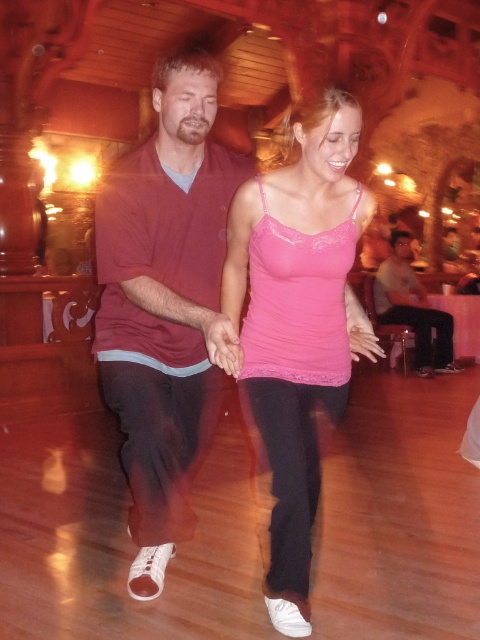
Between point (197, 276) and point (313, 156), which one is positioned in front?

Point (313, 156) is more forward.

From the picture: Does matte maroon shirt at center lie in front of pink lace tank top at center?

Yes, matte maroon shirt at center is in front of pink lace tank top at center.

Locate an element on the screen. This screenshot has height=640, width=480. matte maroon shirt at center is located at coordinates (x=165, y=301).

Can you confirm if pink lace tank top at center is shorter than gray cotton shirt at center?

Correct, pink lace tank top at center is not as tall as gray cotton shirt at center.

Looking at this image, does pink lace tank top at center appear over gray cotton shirt at center?

No, pink lace tank top at center is not above gray cotton shirt at center.

Where is `pink lace tank top at center`? pink lace tank top at center is located at coordinates (299, 323).

Does matte maroon shirt at center lie in front of gray cotton shirt at center?

Yes, matte maroon shirt at center is closer to the viewer.

Is matte maroon shirt at center wider than gray cotton shirt at center?

Incorrect, matte maroon shirt at center's width does not surpass gray cotton shirt at center's.

Locate an element on the screen. The height and width of the screenshot is (640, 480). matte maroon shirt at center is located at coordinates (165, 301).